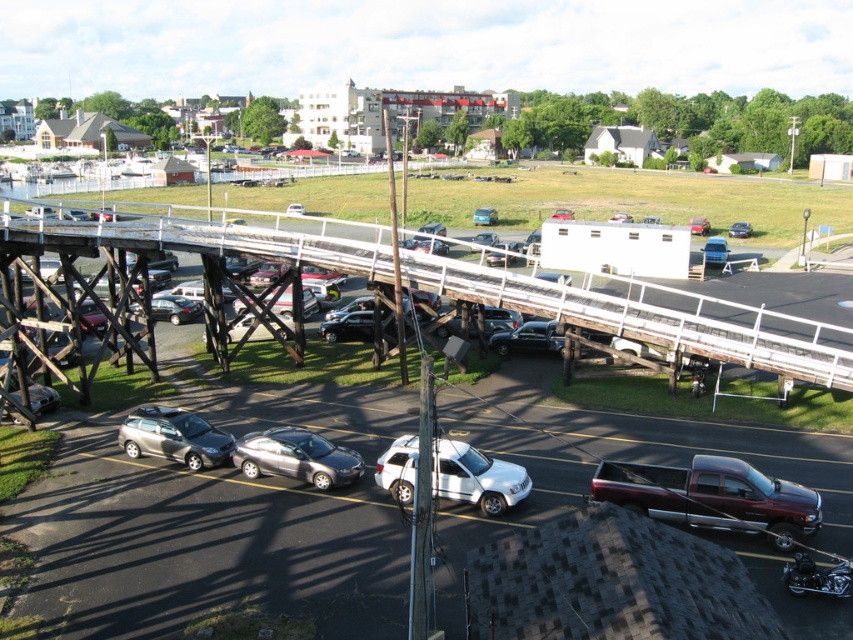
You are a delivery person standing at the camera position and need to cross the wooden bridge at center. If your delivery cart is 2 meters wide, can you safely pass under the bridge without hitting the structure? Please explain your reasoning.

The wooden bridge at center is 29.16 meters away from camera. However, the height of the bridge is not provided in the description, so it is impossible to determine if the delivery cart can pass under it safely. More information about the bridge height is needed to make this assessment.